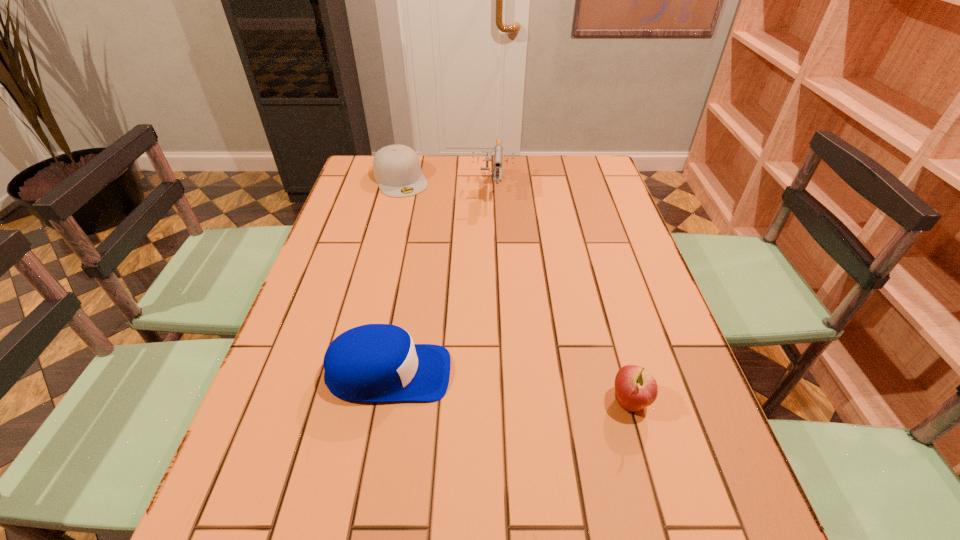
Where is `baseball cap`? baseball cap is located at coordinates (374, 362).

The height and width of the screenshot is (540, 960). I want to click on apple, so click(635, 388).

The width and height of the screenshot is (960, 540). I want to click on cap, so 397,169.

The width and height of the screenshot is (960, 540). In order to click on the tallest object in this screenshot , I will do `click(497, 176)`.

Find the location of a particular element. The width and height of the screenshot is (960, 540). the second object from right to left is located at coordinates (497, 176).

Where is `free spot located 0.220m on the front-facing side of the baseball cap`? The image size is (960, 540). free spot located 0.220m on the front-facing side of the baseball cap is located at coordinates (553, 374).

At what (x,y) coordinates should I click in order to perform the action: click on vacant area situated 0.050m on the back of the apple. Please return your answer as a coordinate pair (x, y). This screenshot has height=540, width=960. Looking at the image, I should click on (619, 365).

At what (x,y) coordinates should I click in order to perform the action: click on free location located 0.100m on the front-facing side of the cap. Please return your answer as a coordinate pair (x, y). This screenshot has width=960, height=540. Looking at the image, I should click on (417, 212).

This screenshot has height=540, width=960. In order to click on free point located 0.220m on the front-facing side of the cap in this screenshot , I will do click(429, 234).

Locate an element on the screen. The width and height of the screenshot is (960, 540). vacant space situated on the front-facing side of the cap is located at coordinates (447, 267).